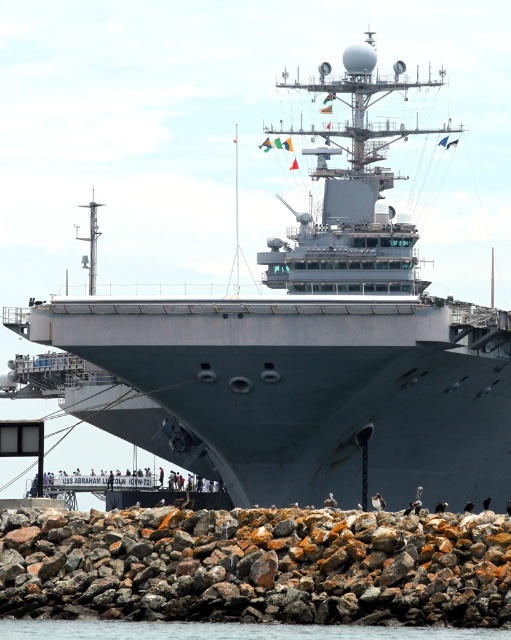
Is rusty rock at lower center to the left of transparent water at lower center from the viewer's perspective?

No, rusty rock at lower center is not to the left of transparent water at lower center.

Is point (267, 570) more distant than point (129, 628)?

That is True.

Locate an element on the screen. Image resolution: width=511 pixels, height=640 pixels. rusty rock at lower center is located at coordinates (258, 566).